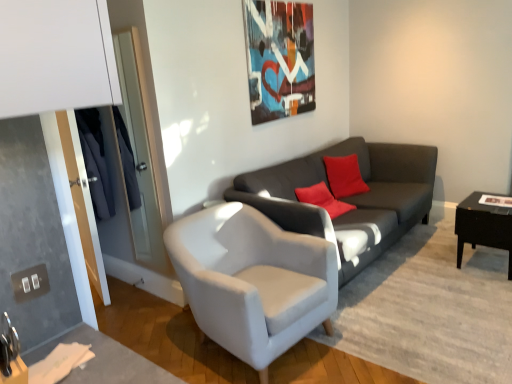
Question: Considering the relative sizes of dark gray fabric couch at center and black glossy table at right in the image provided, is dark gray fabric couch at center smaller than black glossy table at right?

Choices:
 (A) yes
 (B) no

Answer: (B)

Question: Does dark gray fabric couch at center have a larger size compared to black glossy table at right?

Choices:
 (A) yes
 (B) no

Answer: (A)

Question: Considering the relative sizes of dark gray fabric couch at center and black glossy table at right in the image provided, is dark gray fabric couch at center wider than black glossy table at right?

Choices:
 (A) no
 (B) yes

Answer: (B)

Question: From a real-world perspective, is dark gray fabric couch at center positioned under black glossy table at right based on gravity?

Choices:
 (A) yes
 (B) no

Answer: (B)

Question: Can you see dark gray fabric couch at center touching black glossy table at right?

Choices:
 (A) no
 (B) yes

Answer: (A)

Question: From the image's perspective, is dark gray fabric couch at center positioned above or below black glossy table at right?

Choices:
 (A) above
 (B) below

Answer: (A)

Question: Is dark gray fabric couch at center situated inside black glossy table at right or outside?

Choices:
 (A) outside
 (B) inside

Answer: (A)

Question: Considering the relative positions of dark gray fabric couch at center and black glossy table at right in the image provided, is dark gray fabric couch at center to the left or to the right of black glossy table at right?

Choices:
 (A) right
 (B) left

Answer: (B)

Question: Is point (286, 226) positioned closer to the camera than point (465, 236)?

Choices:
 (A) farther
 (B) closer

Answer: (B)

Question: In terms of width, does white fabric armchair at center look wider or thinner when compared to black glossy table at right?

Choices:
 (A) thin
 (B) wide

Answer: (B)

Question: Is white fabric armchair at center inside or outside of black glossy table at right?

Choices:
 (A) outside
 (B) inside

Answer: (A)

Question: Based on their positions, is white fabric armchair at center located to the left or right of black glossy table at right?

Choices:
 (A) right
 (B) left

Answer: (B)

Question: From the image's perspective, relative to black glossy table at right, is white fabric armchair at center above or below?

Choices:
 (A) above
 (B) below

Answer: (B)

Question: In terms of size, does white fabric armchair at center appear bigger or smaller than dark gray fabric couch at center?

Choices:
 (A) big
 (B) small

Answer: (B)

Question: Considering the positions of white fabric armchair at center and dark gray fabric couch at center in the image, is white fabric armchair at center taller or shorter than dark gray fabric couch at center?

Choices:
 (A) tall
 (B) short

Answer: (B)